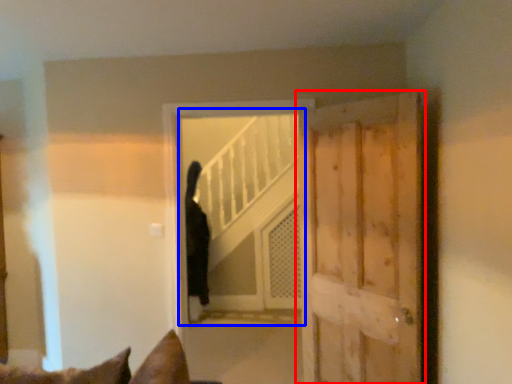
Question: Among these objects, which one is nearest to the camera, door (highlighted by a red box) or elevator (highlighted by a blue box)?

Choices:
 (A) door
 (B) elevator

Answer: (A)